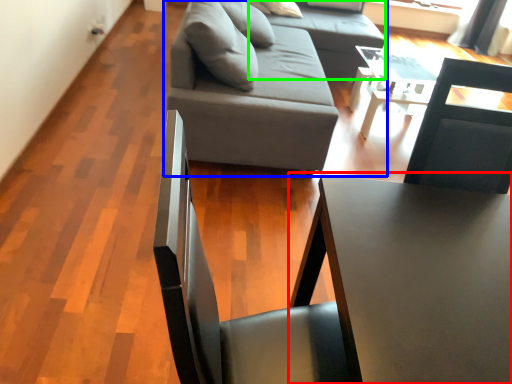
Question: Which is nearer to the table (highlighted by a red box)? studio couch (highlighted by a blue box) or couch (highlighted by a green box).

Choices:
 (A) studio couch
 (B) couch

Answer: (A)